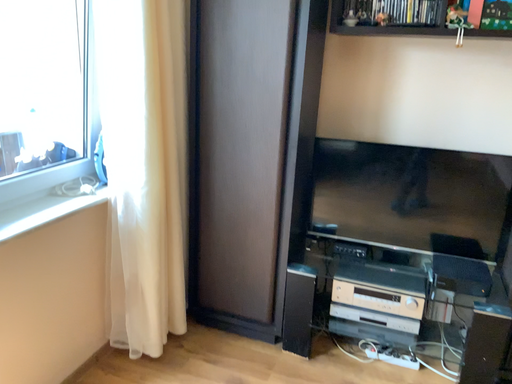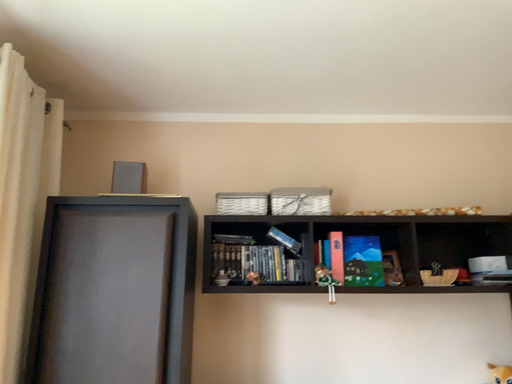
Question: Which way did the camera rotate in the video?

Choices:
 (A) rotated left
 (B) rotated right

Answer: (B)